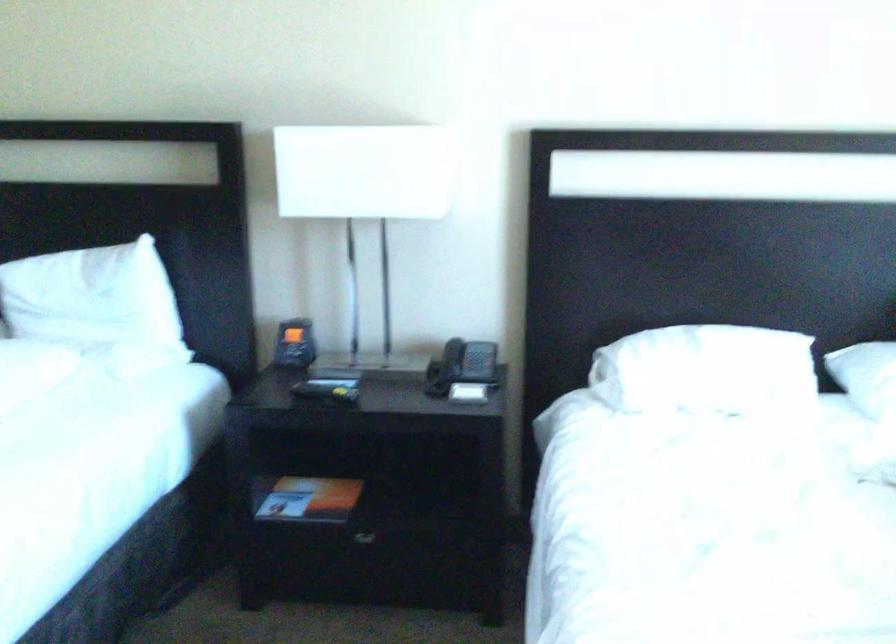
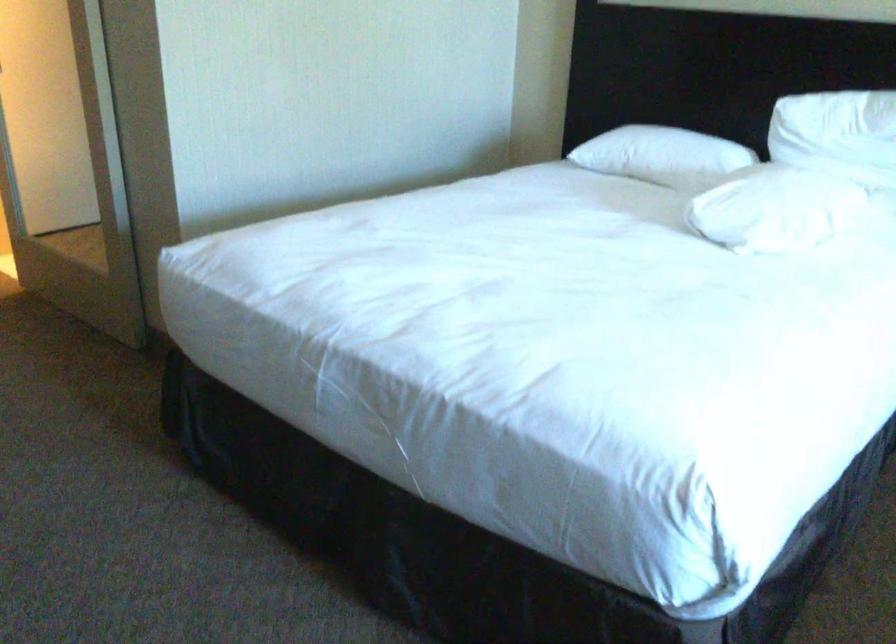
Question: The camera is either moving clockwise (left) or counter-clockwise (right) around the object. The first image is from the beginning of the video and the second image is from the end. Is the camera moving left or right when shooting the video?

Choices:
 (A) Left
 (B) Right

Answer: (B)